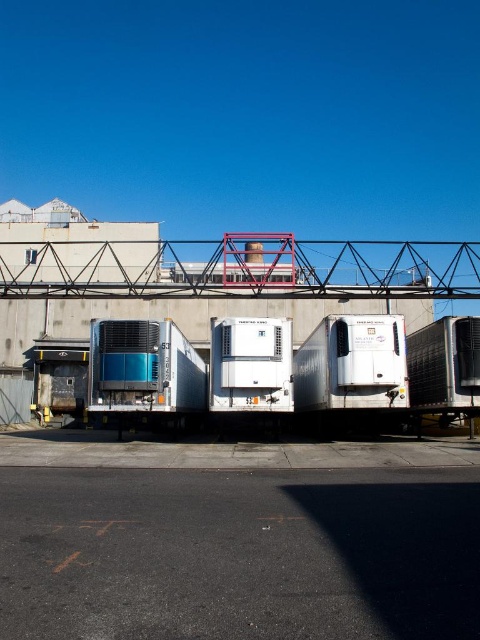
Question: Does metallic red bridge at upper center have a larger size compared to metallic blue trailer truck at center?

Choices:
 (A) yes
 (B) no

Answer: (A)

Question: Is metallic red bridge at upper center behind metallic blue trailer truck at center?

Choices:
 (A) yes
 (B) no

Answer: (A)

Question: Does metallic red bridge at upper center have a smaller size compared to metallic blue trailer truck at center?

Choices:
 (A) yes
 (B) no

Answer: (B)

Question: Which of the following is the farthest from the observer?

Choices:
 (A) metallic red bridge at upper center
 (B) metallic blue trailer truck at center

Answer: (A)